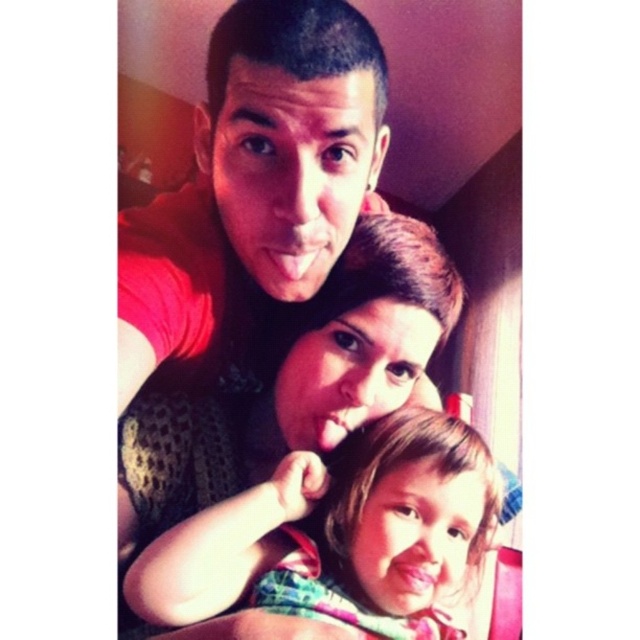
Question: Among these objects, which one is farthest from the camera?

Choices:
 (A) multicolored fabric dress at center
 (B) matte black shirt at center

Answer: (A)

Question: Does red matte t-shirt at upper left appear under multicolored fabric dress at center?

Choices:
 (A) no
 (B) yes

Answer: (A)

Question: Which object is positioned farthest from the multicolored fabric dress at center?

Choices:
 (A) red matte t-shirt at upper left
 (B) matte black shirt at center

Answer: (A)

Question: Does red matte t-shirt at upper left have a smaller size compared to multicolored fabric dress at center?

Choices:
 (A) yes
 (B) no

Answer: (B)

Question: Which object appears closest to the camera in this image?

Choices:
 (A) multicolored fabric dress at center
 (B) matte black shirt at center
 (C) red matte t-shirt at upper left

Answer: (C)

Question: Does red matte t-shirt at upper left have a smaller size compared to multicolored fabric dress at center?

Choices:
 (A) yes
 (B) no

Answer: (B)